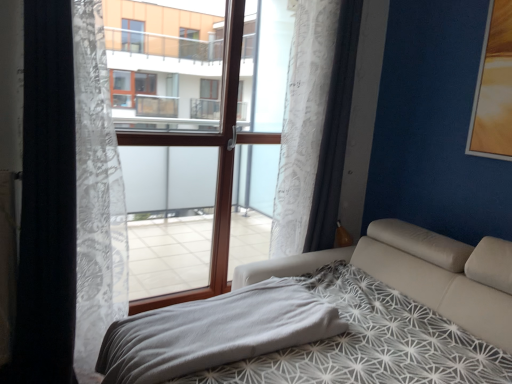
Question: From a real-world perspective, is gray soft blanket at lower center positioned above or below white sheer curtain at left, which ranks as the 3th curtain in right-to-left order?

Choices:
 (A) below
 (B) above

Answer: (A)

Question: In terms of height, does gray soft blanket at lower center look taller or shorter compared to white sheer curtain at left, which ranks as the 3th curtain in right-to-left order?

Choices:
 (A) tall
 (B) short

Answer: (B)

Question: Considering the real-world distances, which object is closest to the white lace curtain at left, marked as the 2th curtain in a left-to-right arrangement?

Choices:
 (A) white lace curtain at center, the 1th curtain viewed from the right
 (B) gray soft blanket at lower center
 (C) white leather bed at center
 (D) white sheer curtain at left, which ranks as the 1th curtain in left-to-right order
 (E) brown wood window frame at center

Answer: (D)

Question: Which is farther from the gray soft blanket at lower center?

Choices:
 (A) white leather bed at center
 (B) white lace curtain at center, the 1th curtain viewed from the right
 (C) brown wood window frame at center
 (D) white lace curtain at left, marked as the 2th curtain in a left-to-right arrangement
 (E) white sheer curtain at left, which ranks as the 1th curtain in left-to-right order

Answer: (C)